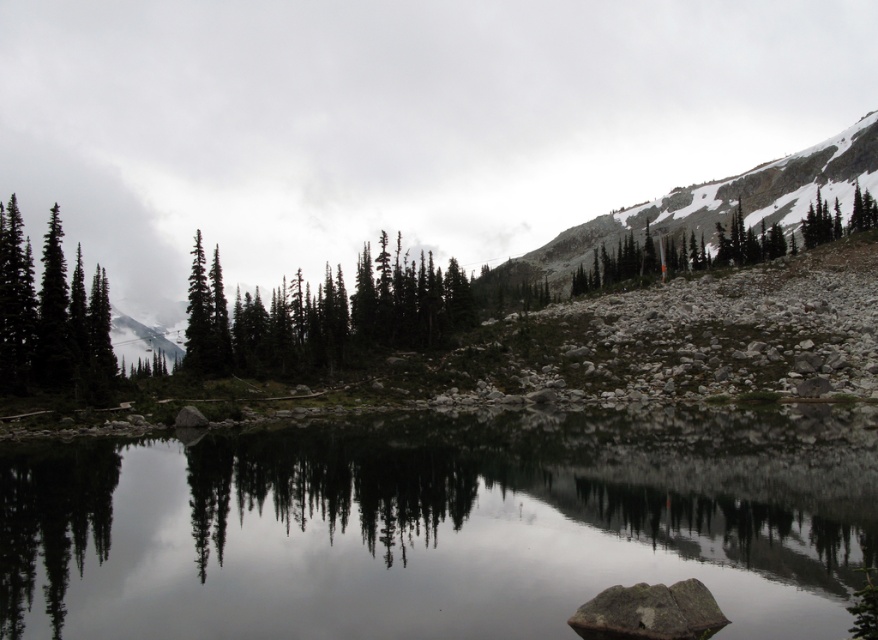
Question: Is smooth reflective water at center above rocky gray mountain at upper right?

Choices:
 (A) no
 (B) yes

Answer: (A)

Question: Which point is farther to the camera?

Choices:
 (A) pos(703,449)
 (B) pos(0,360)
 (C) pos(776,220)

Answer: (C)

Question: Which point is farther to the camera?

Choices:
 (A) green matte evergreen trees at left
 (B) rocky gray mountain at upper right
 (C) green matte trees at center
 (D) smooth reflective water at center

Answer: (B)

Question: Is green matte trees at center smaller than green matte evergreen trees at left?

Choices:
 (A) yes
 (B) no

Answer: (B)

Question: Is green matte trees at center below green matte evergreen trees at left?

Choices:
 (A) yes
 (B) no

Answer: (B)

Question: Based on their relative distances, which object is nearer to the smooth reflective water at center?

Choices:
 (A) rocky gray mountain at upper right
 (B) green matte evergreen trees at left

Answer: (B)